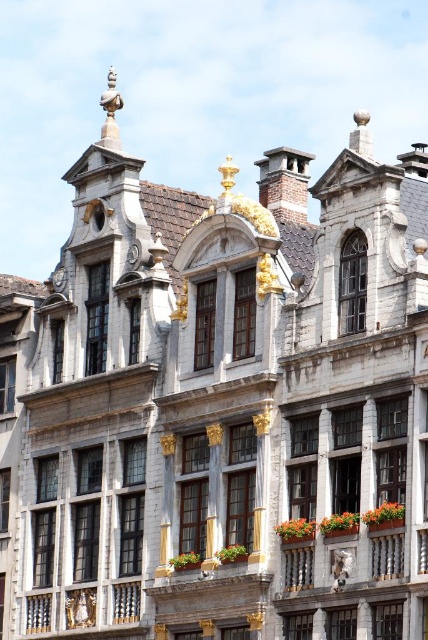
You are a gardener planning to place a new flower box in this historic building. You have an orange fabric flower box at center and a wooden planter at lower right. Which one is wider?

The orange fabric flower box at center is wider than the wooden planter at lower right.